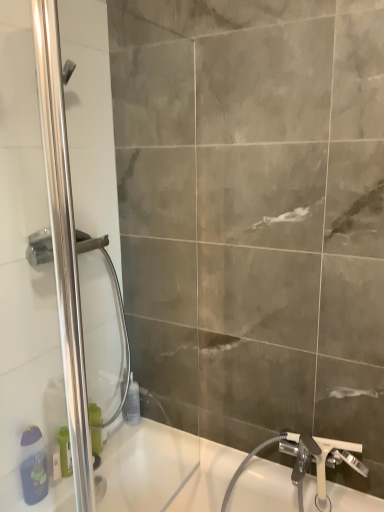
Question: Looking at their shapes, would you say white plastic tap at lower right is wider or thinner than white glossy bathtub at lower left?

Choices:
 (A) thin
 (B) wide

Answer: (A)

Question: Considering the positions of white plastic tap at lower right and white glossy bathtub at lower left in the image, is white plastic tap at lower right taller or shorter than white glossy bathtub at lower left?

Choices:
 (A) short
 (B) tall

Answer: (A)

Question: Based on their relative distances, which object is nearer to the polished stainless steel shower door at left?

Choices:
 (A) green plastic bottle at lower left, acting as the 3th toiletry starting from the left
 (B) white plastic tap at lower right
 (C) white plastic bottle at lower left, which is counted as the third toiletry, starting from the right
 (D) transparent plastic bottle at lower center, the 4th toiletry positioned from the front
 (E) matte purple soap dispenser at lower left, which appears as the 4th toiletry when viewed from the back

Answer: (E)

Question: Considering the real-world distances, which object is closest to the transparent plastic bottle at lower center, marked as the first toiletry in a back-to-front arrangement?

Choices:
 (A) green plastic bottle at lower left, arranged as the 2th toiletry when viewed from the right
 (B) white plastic bottle at lower left, the 3th toiletry viewed from the back
 (C) polished stainless steel shower door at left
 (D) white glossy bathtub at lower left
 (E) white plastic tap at lower right

Answer: (A)